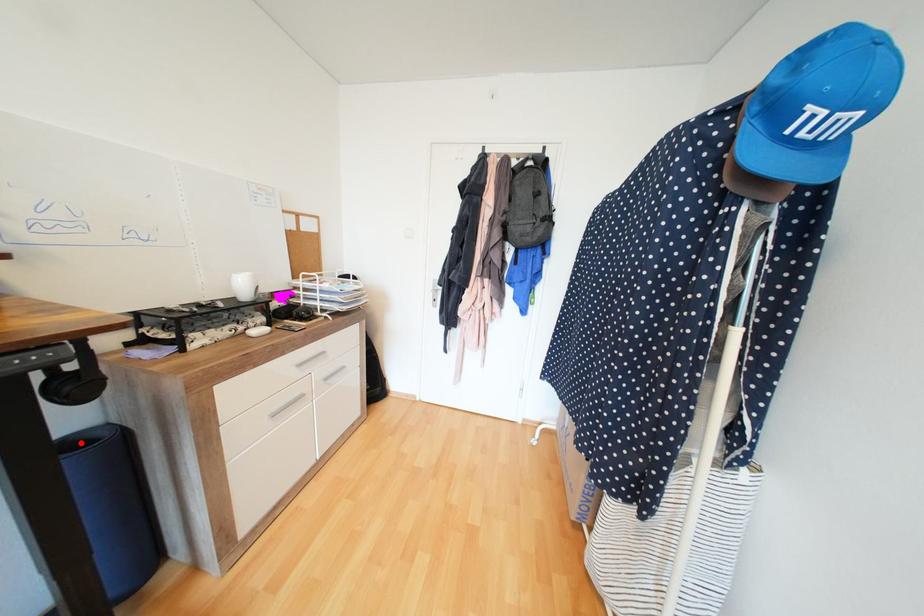
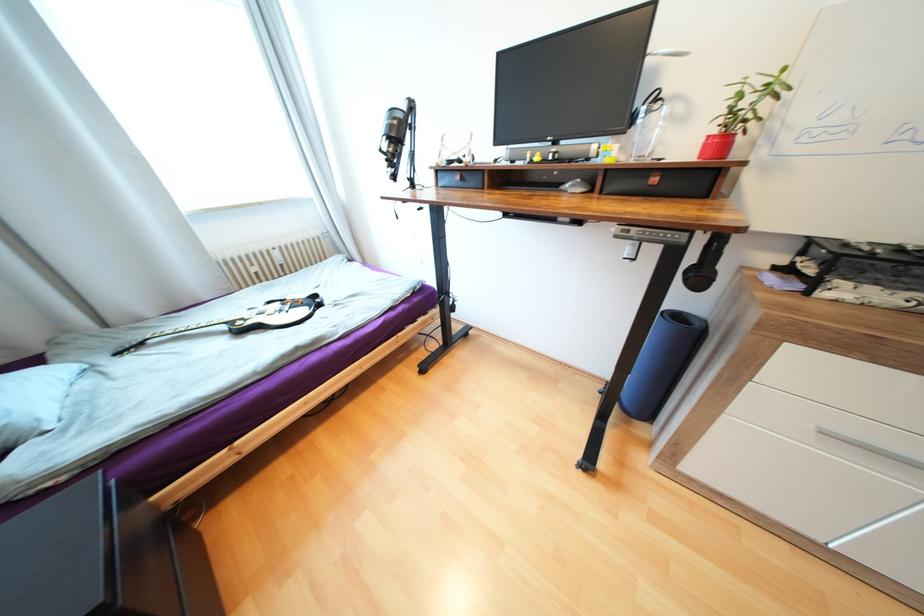
Question: A red point is marked in image1. In image2, is the corresponding 3D point closer to the camera or farther? Reply with the corresponding letter.

Choices:
 (A) The corresponding 3D point is closer.
 (B) The corresponding 3D point is farther.

Answer: (A)